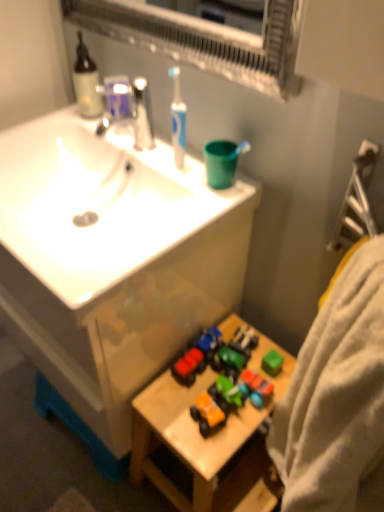
You are a GUI agent. You are given a task and a screenshot of the screen. Output one action in this format:
    pyautogui.click(x=<x>, y=<y>)
    Task: Click on the free space on the front side of orange matte toy car at lower center, which appears as the second toy when viewed from the left
    The width and height of the screenshot is (384, 512).
    Given the screenshot: What is the action you would take?
    pyautogui.click(x=208, y=448)